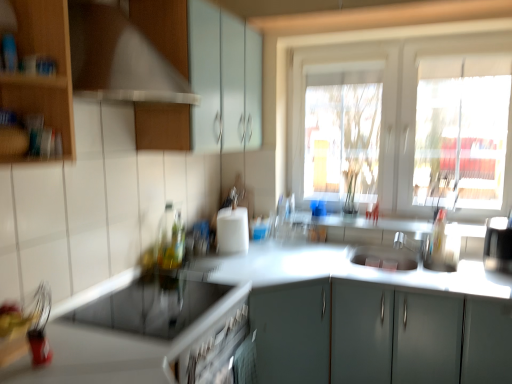
The width and height of the screenshot is (512, 384). What do you see at coordinates (119, 59) in the screenshot? I see `wooden at left` at bounding box center [119, 59].

What do you see at coordinates (417, 336) in the screenshot?
I see `matte gray cabinet at center, placed as the 3th cabinetry when sorted from top to bottom` at bounding box center [417, 336].

I want to click on wooden at left, so click(119, 59).

Which object is thinner, sleek silver coffee machine at right or silver metallic faucet at center?

sleek silver coffee machine at right is thinner.

The height and width of the screenshot is (384, 512). I want to click on coffee machine that is above the silver metallic faucet at center (from the image's perspective), so click(498, 245).

Is sleek silver coffee machine at right looking in the opposite direction of silver metallic faucet at center?

sleek silver coffee machine at right does not have its back to silver metallic faucet at center.

From the image's perspective, who appears lower, matte gray cabinet at center, which appears as the third cabinetry when viewed from the left, or wooden at left?

matte gray cabinet at center, which appears as the third cabinetry when viewed from the left, is shown below in the image.

From a real-world perspective, is matte gray cabinet at center, the first cabinetry from the right, physically below wooden at left?

Yes, from a real-world perspective, matte gray cabinet at center, the first cabinetry from the right, is under wooden at left.

Between point (389, 373) and point (106, 62), which one is positioned in front?

The point (106, 62) is closer.

How distant is matte gray cabinet at center, the first cabinetry from the right, from wooden at left?

The distance of matte gray cabinet at center, the first cabinetry from the right, from wooden at left is 4.26 feet.

Is matte gray cabinet at center, the first cabinetry from the right, far from translucent glass bottle at center, marked as the first bottle in a back-to-front arrangement?

No, matte gray cabinet at center, the first cabinetry from the right, is not far from translucent glass bottle at center, marked as the first bottle in a back-to-front arrangement.

Can you confirm if matte gray cabinet at center, which appears as the third cabinetry when viewed from the left, is thinner than translucent glass bottle at center, acting as the 2th bottle starting from the front?

No.

From the image's perspective, is matte gray cabinet at center, which appears as the third cabinetry when viewed from the left, above or below translucent glass bottle at center, marked as the first bottle in a back-to-front arrangement?

Based on their image positions, matte gray cabinet at center, which appears as the third cabinetry when viewed from the left, is located beneath translucent glass bottle at center, marked as the first bottle in a back-to-front arrangement.

Is the depth of wooden cabinet at left, marked as the first cabinetry in a left-to-right arrangement, greater than that of translucent glass bottle at center, the 1th bottle viewed from the front?

No, wooden cabinet at left, marked as the first cabinetry in a left-to-right arrangement, is in front of translucent glass bottle at center, the 1th bottle viewed from the front.

From the image's perspective, which bottle is the 1st one below the wooden cabinet at left, marked as the second cabinetry in a top-to-bottom arrangement? Please provide its 2D coordinates.

[(170, 239)]

Which is closer to the camera, (46, 106) or (162, 234)?

The point (46, 106) is closer to the camera.

Who is smaller, wooden cabinet at left, which ranks as the 2th cabinetry in bottom-to-top order, or translucent glass bottle at center, which ranks as the 2th bottle in back-to-front order?

translucent glass bottle at center, which ranks as the 2th bottle in back-to-front order.

Is translucent glass bottle at center, marked as the first bottle in a back-to-front arrangement, oriented towards matte white cabinet at upper center, which is the 2th cabinetry from left to right?

No, translucent glass bottle at center, marked as the first bottle in a back-to-front arrangement, is not aimed at matte white cabinet at upper center, which is the 2th cabinetry from left to right.

Is point (176, 265) more distant than point (189, 78)?

Yes, point (176, 265) is behind point (189, 78).

Would you say translucent glass bottle at center, acting as the 2th bottle starting from the front, is inside or outside matte white cabinet at upper center, arranged as the 3th cabinetry when ordered from the bottom?

translucent glass bottle at center, acting as the 2th bottle starting from the front, is spatially situated outside matte white cabinet at upper center, arranged as the 3th cabinetry when ordered from the bottom.

From a real-world perspective, is white glossy countertop at lower left, the second countertop in the bottom-to-top sequence, on translucent glass bottle at center, acting as the 2th bottle starting from the front?

No, from a real-world perspective, white glossy countertop at lower left, the second countertop in the bottom-to-top sequence, is not on top of translucent glass bottle at center, acting as the 2th bottle starting from the front.

Could you tell me if white glossy countertop at lower left, acting as the first countertop starting from the top, is turned towards translucent glass bottle at center, marked as the first bottle in a back-to-front arrangement?

No, white glossy countertop at lower left, acting as the first countertop starting from the top, does not turn towards translucent glass bottle at center, marked as the first bottle in a back-to-front arrangement.

Relative to translucent glass bottle at center, acting as the 2th bottle starting from the front, is white glossy countertop at lower left, acting as the first countertop starting from the top, in front or behind?

In the image, white glossy countertop at lower left, acting as the first countertop starting from the top, appears in front of translucent glass bottle at center, acting as the 2th bottle starting from the front.

Measure the distance from white glossy countertop at lower left, acting as the first countertop starting from the top, to translucent glass bottle at center, marked as the first bottle in a back-to-front arrangement.

A distance of 20.66 inches exists between white glossy countertop at lower left, acting as the first countertop starting from the top, and translucent glass bottle at center, marked as the first bottle in a back-to-front arrangement.

In terms of width, does matte white cabinet at upper center, the second cabinetry positioned from the right, look wider or thinner when compared to translucent glass bottle at center, the 1th bottle viewed from the front?

Clearly, matte white cabinet at upper center, the second cabinetry positioned from the right, has more width compared to translucent glass bottle at center, the 1th bottle viewed from the front.

Can you tell me how much matte white cabinet at upper center, the second cabinetry positioned from the right, and translucent glass bottle at center, which ranks as the 2th bottle in back-to-front order, differ in facing direction?

There is a 0.144-degree angle between the facing directions of matte white cabinet at upper center, the second cabinetry positioned from the right, and translucent glass bottle at center, which ranks as the 2th bottle in back-to-front order.

Is matte white cabinet at upper center, which is the 2th cabinetry from left to right, inside or outside of translucent glass bottle at center, the 1th bottle viewed from the front?

matte white cabinet at upper center, which is the 2th cabinetry from left to right, is not enclosed by translucent glass bottle at center, the 1th bottle viewed from the front.

Measure the distance between matte white cabinet at upper center, which is the 2th cabinetry from left to right, and translucent glass bottle at center, the 1th bottle viewed from the front.

28.02 inches.

Identify the location of coffee machine on the right of silver metallic faucet at center. This screenshot has width=512, height=384. (498, 245).

There is a matte gray cabinet at center, which appears as the third cabinetry when viewed from the left. Where is `exhaust hood above it (from a real-world perspective)`? The image size is (512, 384). exhaust hood above it (from a real-world perspective) is located at coordinates (119, 59).

In the scene shown: Looking at the image, which one is located further to white glossy countertop at center, positioned as the 1th countertop in bottom-to-top order, white glossy window at upper center or translucent glass bottle at center, marked as the first bottle in a back-to-front arrangement?

The object further to white glossy countertop at center, positioned as the 1th countertop in bottom-to-top order, is white glossy window at upper center.

Looking at the image, which one is located further to translucent glass bottle at center, acting as the 2th bottle starting from the front, translucent glass bottle at center, the 1th bottle viewed from the front, or wooden cabinet at left, which ranks as the 2th cabinetry in bottom-to-top order?

wooden cabinet at left, which ranks as the 2th cabinetry in bottom-to-top order, is further to translucent glass bottle at center, acting as the 2th bottle starting from the front.

Looking at the image, which one is located further to matte gray cabinet at center, the first cabinetry from the right, white glossy window at upper center or sleek silver coffee machine at right?

Answer: white glossy window at upper center lies further to matte gray cabinet at center, the first cabinetry from the right, than the other object.

Which object lies further to the anchor point matte gray cabinet at center, which appears as the third cabinetry when viewed from the left, translucent glass bottle at center, marked as the first bottle in a back-to-front arrangement, or wooden cabinet at left, which ranks as the 2th cabinetry in bottom-to-top order?

The object further to matte gray cabinet at center, which appears as the third cabinetry when viewed from the left, is wooden cabinet at left, which ranks as the 2th cabinetry in bottom-to-top order.

When comparing their distances from translucent glass bottle at center, marked as the first bottle in a back-to-front arrangement, does wooden at left or silver metallic faucet at center seem further?

Among the two, silver metallic faucet at center is located further to translucent glass bottle at center, marked as the first bottle in a back-to-front arrangement.

From the image, which object appears to be nearer to translucent glass bottle at center, marked as the first bottle in a back-to-front arrangement, white glossy window at upper center or white matte paper towel holder at center?

white matte paper towel holder at center is positioned closer to the anchor translucent glass bottle at center, marked as the first bottle in a back-to-front arrangement.

Considering their positions, is white matte paper towel holder at center positioned closer to wooden cabinet at left, marked as the second cabinetry in a top-to-bottom arrangement, than silver metallic faucet at center?

white matte paper towel holder at center is positioned closer to the anchor wooden cabinet at left, marked as the second cabinetry in a top-to-bottom arrangement.

Consider the image. Considering their positions, is white glossy window at upper center positioned further to matte gray cabinet at center, the first cabinetry from the right, than wooden cabinet at left, marked as the third cabinetry in a right-to-left arrangement?

wooden cabinet at left, marked as the third cabinetry in a right-to-left arrangement, is further to matte gray cabinet at center, the first cabinetry from the right.

You are a GUI agent. You are given a task and a screenshot of the screen. Output one action in this format:
    pyautogui.click(x=<x>, y=<y>)
    Task: Click on the faucet between white glossy window at upper center and matte gray cabinet at center, which appears as the third cabinetry when viewed from the left, in the up-down direction
    This screenshot has width=512, height=384.
    Given the screenshot: What is the action you would take?
    pyautogui.click(x=408, y=244)

The width and height of the screenshot is (512, 384). I want to click on cabinetry between white matte paper towel holder at center and sleek silver coffee machine at right, so click(417, 336).

The width and height of the screenshot is (512, 384). I want to click on exhaust hood between wooden cabinet at left, marked as the first cabinetry in a left-to-right arrangement, and translucent glass bottle at center, the 1th bottle viewed from the front, along the z-axis, so click(119, 59).

Find the location of a particular element. This screenshot has width=512, height=384. exhaust hood between white glossy countertop at center, positioned as the 1th countertop in bottom-to-top order, and white matte paper towel holder at center, along the z-axis is located at coordinates (119, 59).